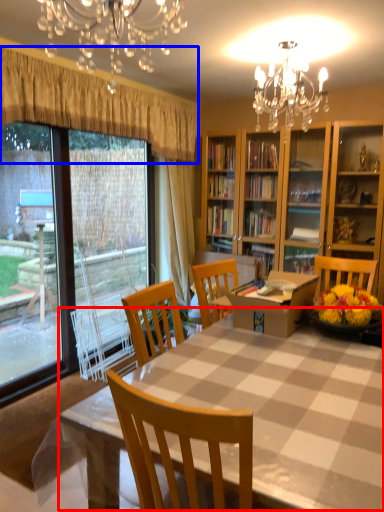
Question: Which object appears farthest to the camera in this image, kitchen & dining room table (highlighted by a red box) or curtain (highlighted by a blue box)?

Choices:
 (A) kitchen & dining room table
 (B) curtain

Answer: (B)